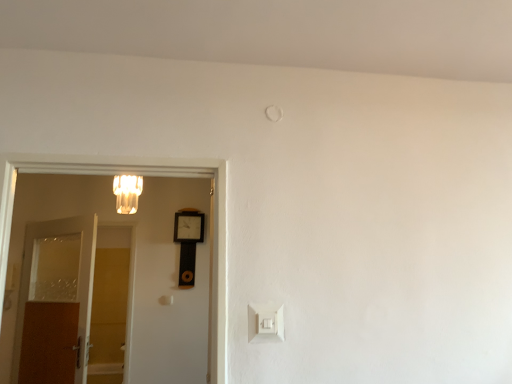
Question: Visually, is white plastic light switch at lower center positioned to the left or to the right of wooden clock at center?

Choices:
 (A) right
 (B) left

Answer: (A)

Question: From a real-world perspective, is white plastic light switch at lower center above or below wooden clock at center?

Choices:
 (A) below
 (B) above

Answer: (A)

Question: Estimate the real-world distances between objects in this image. Which object is closer to the wooden clock at center?

Choices:
 (A) brown wooden door at left, acting as the 2th door starting from the right
 (B) matte glass chandelier at upper left
 (C) white wooden door at left, marked as the first door in a front-to-back arrangement
 (D) white plastic light switch at lower center

Answer: (A)

Question: Estimate the real-world distances between objects in this image. Which object is farther from the white wooden door at left, positioned as the second door in left-to-right order?

Choices:
 (A) wooden clock at center
 (B) brown wooden door at left, acting as the 2th door starting from the right
 (C) matte glass chandelier at upper left
 (D) white plastic light switch at lower center

Answer: (A)